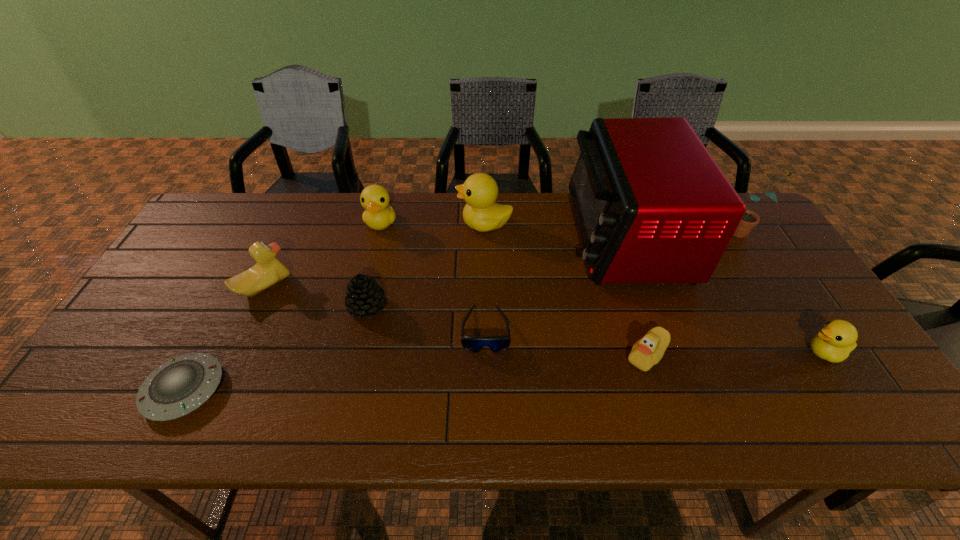
Locate an element on the screen. This screenshot has width=960, height=540. vacant space at the near right corner of the desktop is located at coordinates (853, 410).

This screenshot has height=540, width=960. Identify the location of vacant area between the pinecone and the rightmost yellow duck. (596, 329).

The image size is (960, 540). Identify the location of vacant area that lies between the saucer and the leftmost duck. pyautogui.click(x=225, y=338).

You are a GUI agent. You are given a task and a screenshot of the screen. Output one action in this format:
    pyautogui.click(x=<x>, y=<y>)
    Task: Click on the vacant point located between the third farthest duck and the ninth shortest object
    The image size is (960, 540).
    Given the screenshot: What is the action you would take?
    pyautogui.click(x=505, y=259)

You are a GUI agent. You are given a task and a screenshot of the screen. Output one action in this format:
    pyautogui.click(x=<x>, y=<y>)
    Task: Click on the empty location between the second tallest object and the second biggest yellow duck
    This screenshot has height=540, width=960.
    Given the screenshot: What is the action you would take?
    pyautogui.click(x=563, y=227)

Locate an element on the screen. free area in between the shortest object and the rightmost yellow duck is located at coordinates (505, 371).

The height and width of the screenshot is (540, 960). Identify the location of empty location between the third nearest duck and the sunflower. (505, 259).

Identify the location of vacant space that is in between the third tallest object and the pinecone. This screenshot has height=540, width=960. (426, 265).

At what (x,y) coordinates should I click in order to perform the action: click on unoccupied position between the second yellow duck from left to right and the pinecone. Please return your answer as a coordinate pair (x, y). The height and width of the screenshot is (540, 960). Looking at the image, I should click on (426, 265).

I want to click on object identified as the closest to the second biggest yellow duck, so click(x=481, y=213).